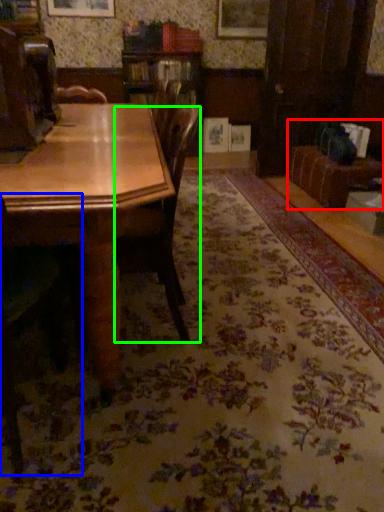
Question: Which is farther away from couch (highlighted by a red box)? chair (highlighted by a blue box) or chair (highlighted by a green box)?

Choices:
 (A) chair
 (B) chair

Answer: (A)